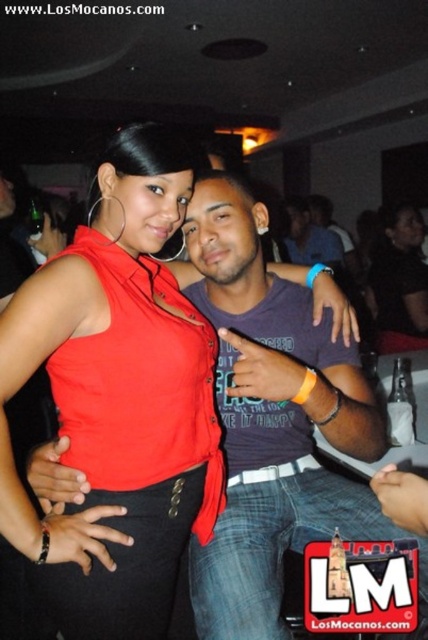
You are a photographer at the event and want to ensure both the satin red top at center and the matte purple shirt at center are visible in your photo. Given their positions, which top should you focus on to capture both in frame without cropping?

The satin red top at center has a greater height compared to matte purple shirt at center, so focusing on the satin red top at center will ensure both are visible without cropping.

You are a photographer at the event and need to capture a photo that includes both the matte purple shirt at center and the purple cotton shirt at center. Given that your camera has a maximum focus range of 3 meters, will you be able to include both in the same frame without moving closer?

The matte purple shirt at center and the purple cotton shirt at center are 3.78 meters apart. Since the distance between them exceeds the camera maximum focus range of 3 meters, you will not be able to include both in the same frame without moving closer.